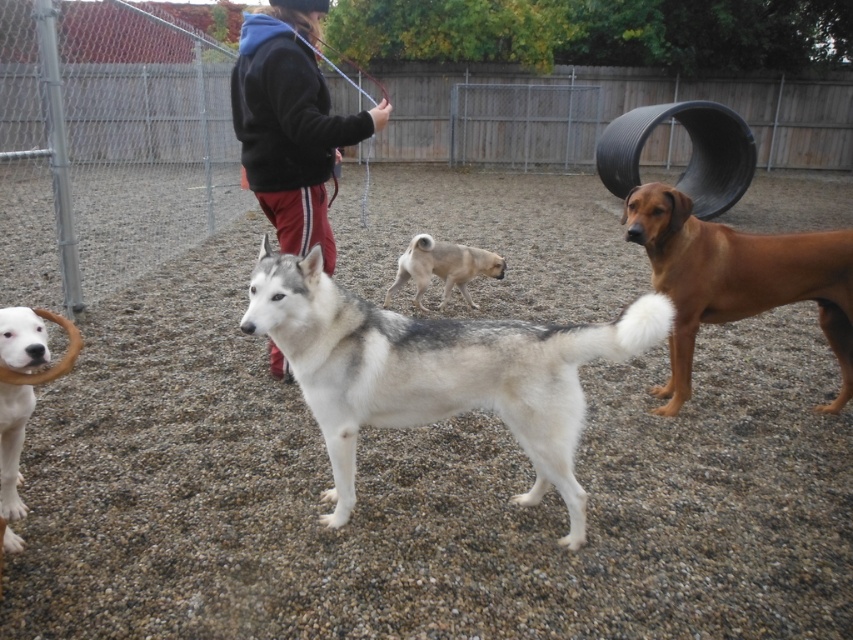
Can you confirm if brown glossy dog at right is positioned to the left of light brown fur at center?

In fact, brown glossy dog at right is to the right of light brown fur at center.

Can you confirm if brown glossy dog at right is positioned above light brown fur at center?

Actually, brown glossy dog at right is below light brown fur at center.

In order to click on brown glossy dog at right in this screenshot , I will do `click(735, 280)`.

Who is shorter, black fleece jacket at center or light brown fur at center?

light brown fur at center is shorter.

Does black fleece jacket at center have a lesser height compared to light brown fur at center?

No.

Does point (340, 140) come closer to viewer compared to point (436, 243)?

Yes, point (340, 140) is in front of point (436, 243).

The image size is (853, 640). In order to click on black fleece jacket at center in this screenshot , I will do click(289, 124).

Does brown glossy dog at right have a greater width compared to black fleece jacket at center?

Yes.

Between point (811, 289) and point (294, 97), which one is positioned behind?

Positioned behind is point (811, 289).

Image resolution: width=853 pixels, height=640 pixels. What do you see at coordinates (735, 280) in the screenshot?
I see `brown glossy dog at right` at bounding box center [735, 280].

At what (x,y) coordinates should I click in order to perform the action: click on brown glossy dog at right. Please return your answer as a coordinate pair (x, y). The width and height of the screenshot is (853, 640). Looking at the image, I should click on (735, 280).